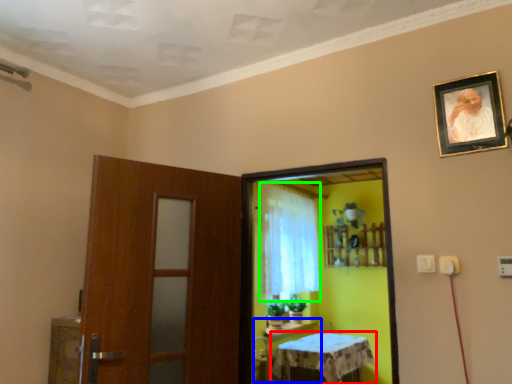
Question: Which object is positioned closest to furniture (highlighted by a red box)? Select from table (highlighted by a blue box) and curtain (highlighted by a green box).

Choices:
 (A) table
 (B) curtain

Answer: (A)